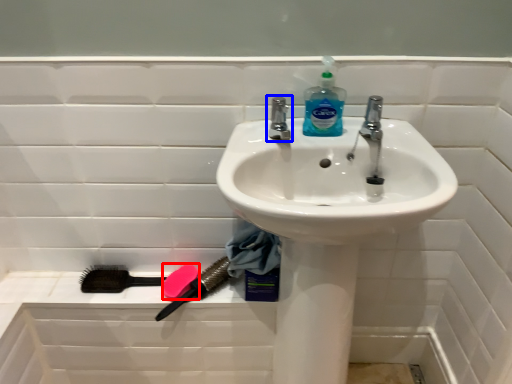
Question: Which of the following is the closest to the observer, soap (highlighted by a red box) or tap (highlighted by a blue box)?

Choices:
 (A) soap
 (B) tap

Answer: (B)